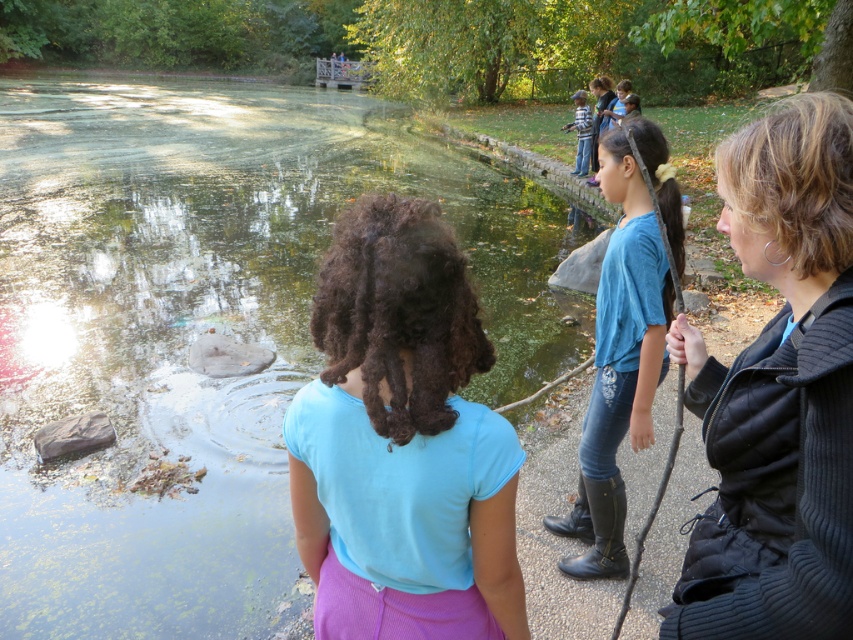
You are standing at the edge of the pond and want to hand a small item to someone. You have a blue fabric shirt at center in your line of sight and a blue denim jeans at upper center also visible. Which person should you target to ensure the item reaches the intended recipient without needing to move closer?

You should target the blue fabric shirt at center because it is closer to you than the blue denim jeans at upper center, being only 47.18 feet away.

You are a photographer trying to capture the scene of the two girls by the pond. You want to focus on the blue fabric shirt at center and the blue denim jeans at upper center. Which object should you adjust your camera focus on first if you want to ensure both are in focus?

The blue fabric shirt at center is closer to the viewer than the blue denim jeans at upper center, so you should focus on the blue fabric shirt at center first to ensure both are in focus.